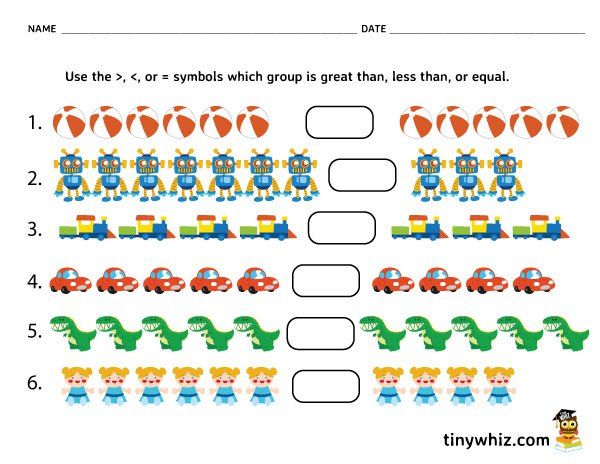
Image resolution: width=600 pixels, height=464 pixels. Identify the location of doll. (75, 380), (105, 380), (157, 373), (184, 376), (216, 376), (250, 377), (386, 384), (426, 382), (457, 379), (491, 377).